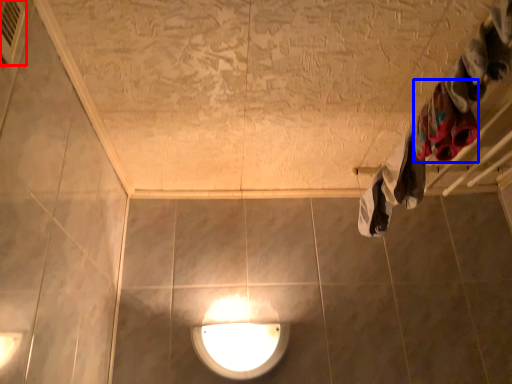
Question: Which of the following is the closest to the observer, air conditioner (highlighted by a red box) or clothing (highlighted by a blue box)?

Choices:
 (A) air conditioner
 (B) clothing

Answer: (A)